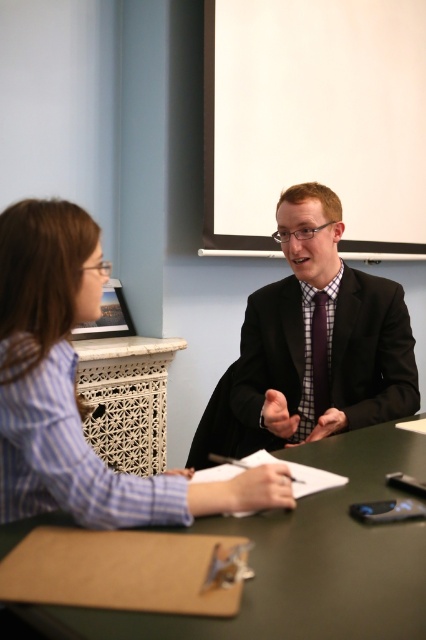
You are a tailor observing the professional meeting scene. You need to determine which item requires more fabric for alterations between the matte black suit at center and the purple satin tie at center. Which one would you prioritize?

The matte black suit at center requires more fabric for alterations since its width is larger than the purple satin tie at center.

From the picture: You are standing in front of the conference table and want to place a small object on the table. You have two points to choose from. The first point is at coordinates point (160, 634) and the second is at point (60, 352). Which point is closer to you?

Point (160, 634) is closer to the viewer than point (60, 352).

You are a person sitting at the green matte table at center. You need to reach for the pen on the table. Considering the height of the table compared to your blue striped shirt at left, will you have to bend down or stand up to reach it?

The green matte table at center is not as tall as the blue striped shirt at left, which means the table is shorter than the shirt. Since the shirt is part of your clothing, this implies the table is lower than your waist or torso level. Therefore, you would likely need to bend down slightly to reach the pen on the table.